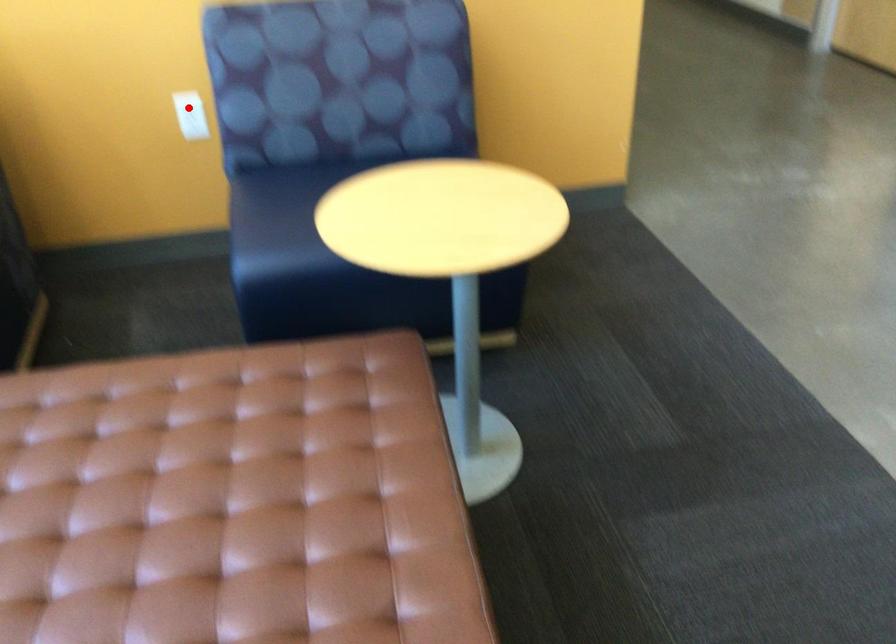
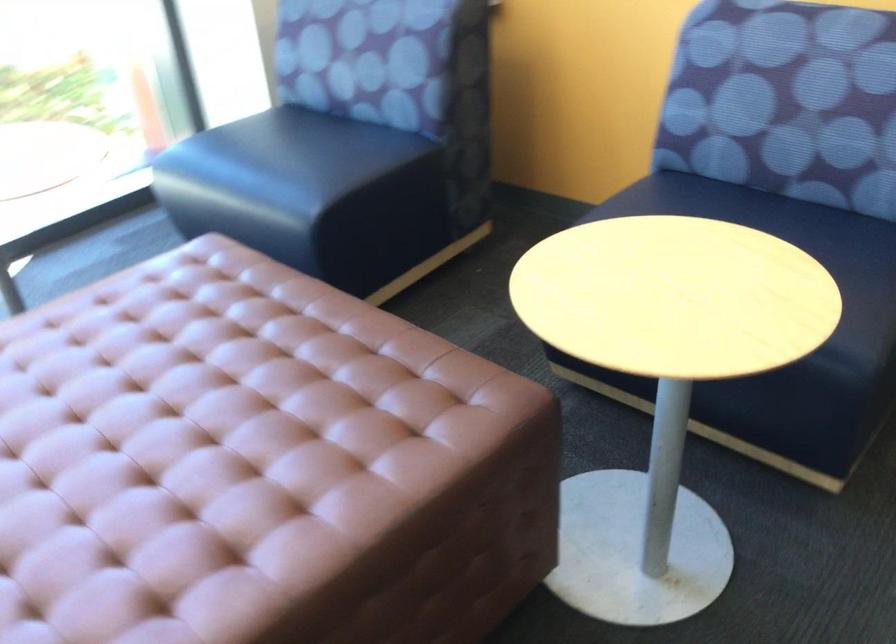
Question: I am providing you with two images of the same scene from different viewpoints. A red point is marked on the first image. Is the red point's position out of view in image 2?

Choices:
 (A) Yes
 (B) No

Answer: (A)